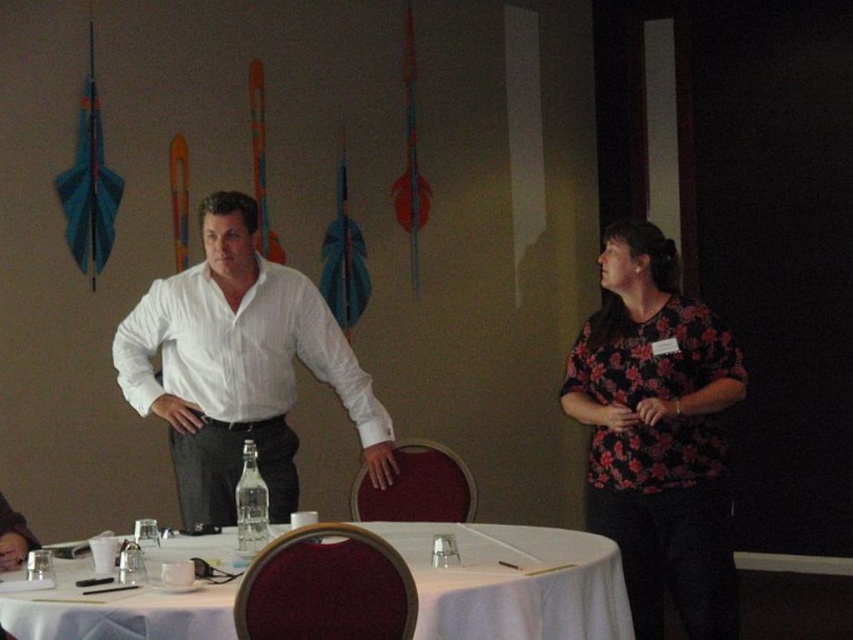
Who is higher up, floral print blouse at center or white fabric table at center?

floral print blouse at center is higher up.

Is point (666, 285) closer to camera compared to point (596, 611)?

That is False.

Which is behind, point (683, 582) or point (77, 568)?

The point (683, 582) is behind.

The width and height of the screenshot is (853, 640). I want to click on floral print blouse at center, so click(x=657, y=435).

Can you confirm if floral print blouse at center is shorter than white striped shirt at center?

In fact, floral print blouse at center may be taller than white striped shirt at center.

What do you see at coordinates (657, 435) in the screenshot? I see `floral print blouse at center` at bounding box center [657, 435].

Where is `floral print blouse at center`? floral print blouse at center is located at coordinates (657, 435).

Measure the distance between white striped shirt at center and white fabric table at center.

white striped shirt at center is 31.62 inches from white fabric table at center.

Can you confirm if white striped shirt at center is positioned to the left of white fabric table at center?

Yes, white striped shirt at center is to the left of white fabric table at center.

Measure the distance between white striped shirt at center and camera.

white striped shirt at center and camera are 3.07 meters apart.

Where is `white striped shirt at center`? The width and height of the screenshot is (853, 640). white striped shirt at center is located at coordinates (239, 368).